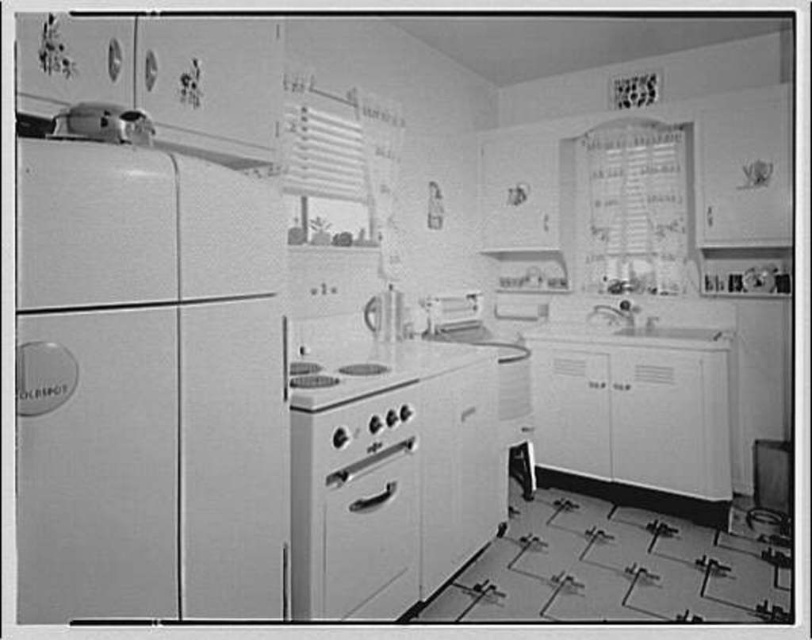
Question: Which of these objects is positioned farthest from the white matte refrigerator at left?

Choices:
 (A) white glossy oven at center
 (B) white glossy stove at center

Answer: (B)

Question: Can you confirm if white matte refrigerator at left is thinner than white glossy oven at center?

Choices:
 (A) no
 (B) yes

Answer: (A)

Question: Which object is positioned closest to the white glossy oven at center?

Choices:
 (A) white glossy stove at center
 (B) white matte refrigerator at left

Answer: (A)

Question: Which of the following is the farthest from the observer?

Choices:
 (A) white matte refrigerator at left
 (B) white glossy oven at center

Answer: (B)

Question: Where is white matte refrigerator at left located in relation to white glossy oven at center in the image?

Choices:
 (A) left
 (B) right

Answer: (A)

Question: Is white glossy oven at center in front of white glossy stove at center?

Choices:
 (A) no
 (B) yes

Answer: (A)